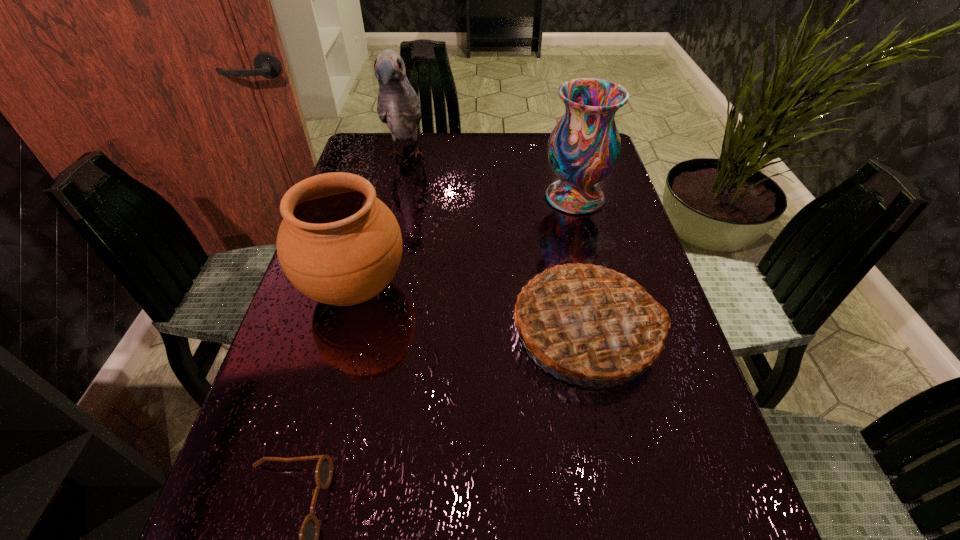
Locate which object ranks second in proximity to the pottery. Please provide its 2D coordinates. Your answer should be formatted as a tuple, i.e. [(x, y)], where the tuple contains the x and y coordinates of a point satisfying the conditions above.

[(309, 533)]

Identify which object is the fourth closest to the pie. Please provide its 2D coordinates. Your answer should be formatted as a tuple, i.e. [(x, y)], where the tuple contains the x and y coordinates of a point satisfying the conditions above.

[(398, 106)]

The height and width of the screenshot is (540, 960). I want to click on blank area in the image that satisfies the following two spatial constraints: 1. on the back side of the pottery; 2. on the left side of the vase, so click(379, 197).